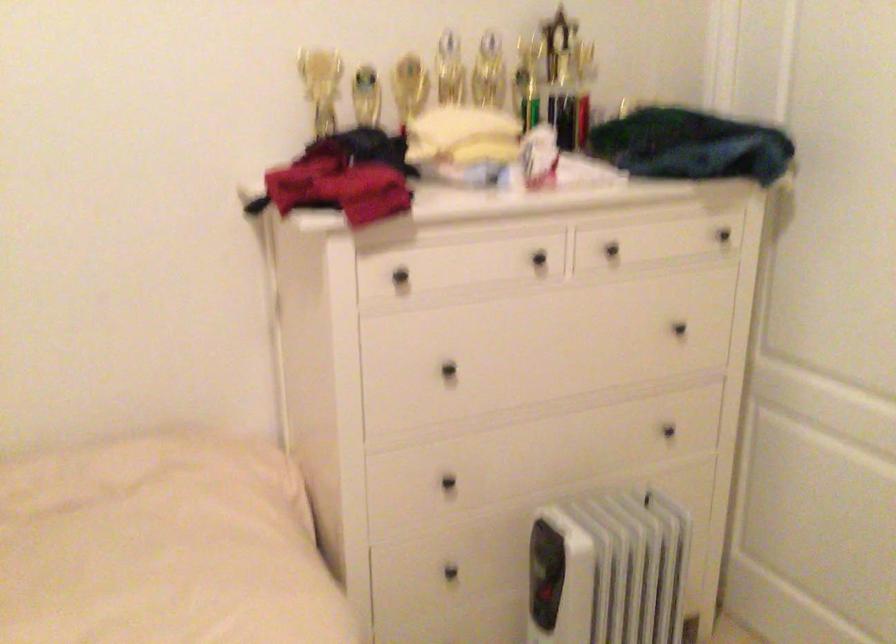
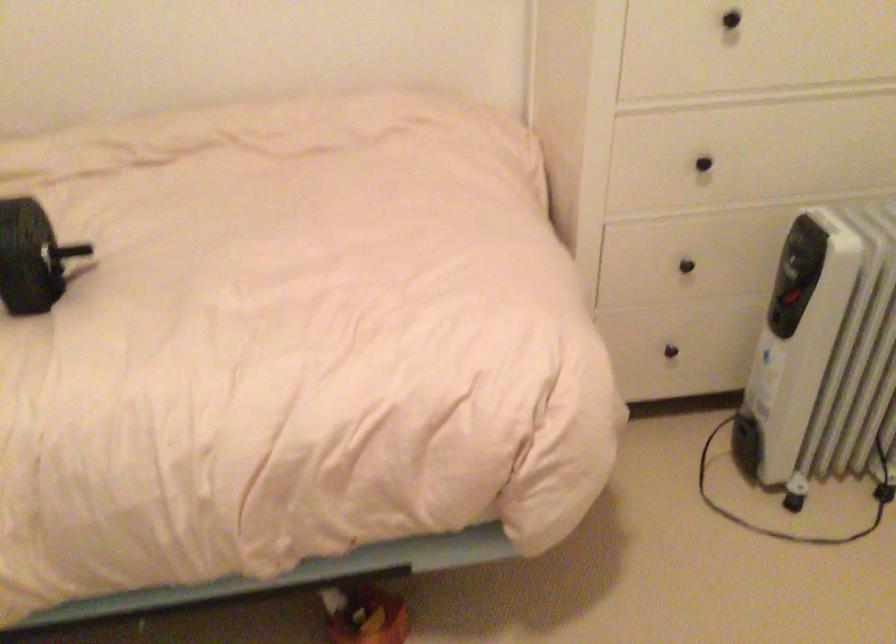
The point at (449, 368) is marked in the first image. Where is the corresponding point in the second image?

(730, 19)